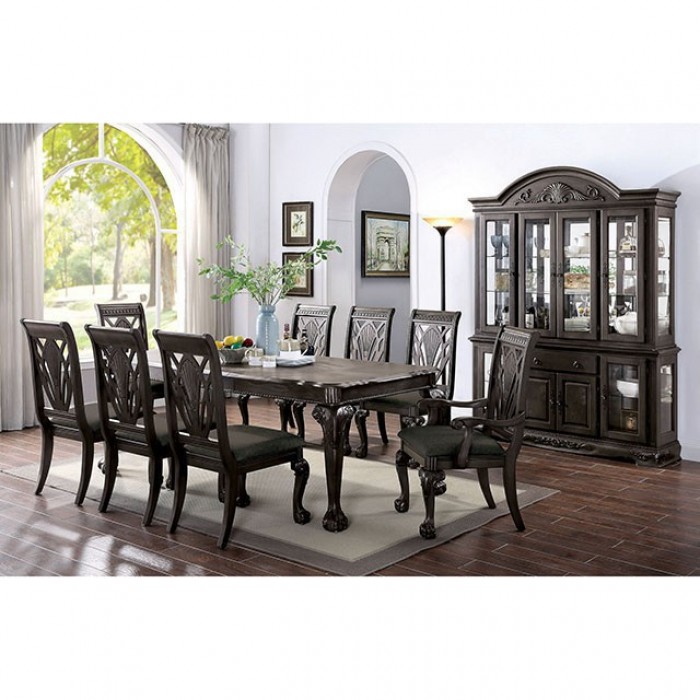
At what (x,y) coordinates should I click in order to perform the action: click on chairs. Please return your answer as a coordinate pair (x, y). Looking at the image, I should click on (125, 349), (56, 335), (192, 343), (125, 304), (315, 312), (384, 312), (441, 312), (510, 342).